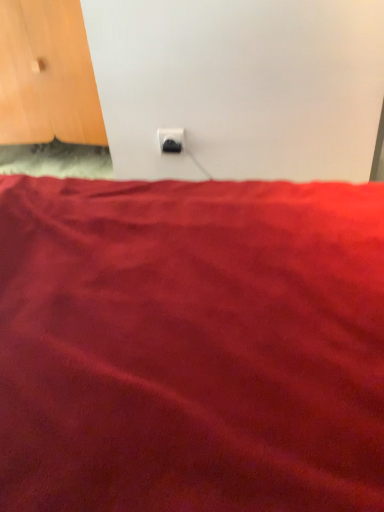
Question: Looking at their shapes, would you say black plastic power plug at center is wider or thinner than wooden door at upper left?

Choices:
 (A) wide
 (B) thin

Answer: (B)

Question: In terms of height, does black plastic power plug at center look taller or shorter compared to wooden door at upper left?

Choices:
 (A) short
 (B) tall

Answer: (A)

Question: Considering the relative positions of black plastic power plug at center and wooden door at upper left in the image provided, is black plastic power plug at center to the left or to the right of wooden door at upper left?

Choices:
 (A) left
 (B) right

Answer: (B)

Question: Based on their sizes in the image, would you say wooden door at upper left is bigger or smaller than black plastic power plug at center?

Choices:
 (A) big
 (B) small

Answer: (A)

Question: Does point (49, 51) appear closer or farther from the camera than point (182, 139)?

Choices:
 (A) closer
 (B) farther

Answer: (B)

Question: Visually, is wooden door at upper left positioned to the left or to the right of black plastic power plug at center?

Choices:
 (A) right
 (B) left

Answer: (B)

Question: Relative to black plastic power plug at center, is wooden door at upper left in front or behind?

Choices:
 (A) front
 (B) behind

Answer: (B)